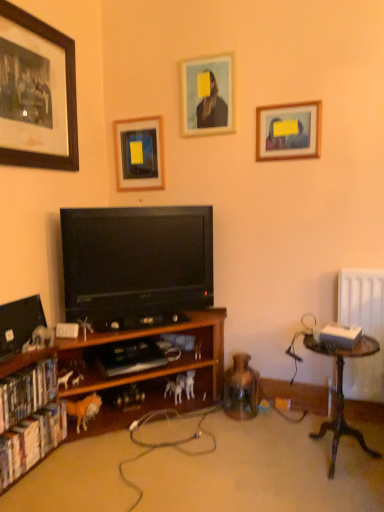
Question: In the image, is matte black picture frame at upper left, which is counted as the 4th picture frame, starting from the right, positioned in front of or behind orange plush horse at lower left, placed as the second animal when sorted from right to left?

Choices:
 (A) behind
 (B) front

Answer: (B)

Question: Choose the correct answer: Is matte black picture frame at upper left, which ranks as the first picture frame in left-to-right order, inside orange plush horse at lower left, the 2th animal positioned from the front, or outside it?

Choices:
 (A) inside
 (B) outside

Answer: (B)

Question: Which object is positioned closest to the white matte horse at lower center, placed as the first animal when sorted from right to left?

Choices:
 (A) wooden table at right
 (B) matte black picture frame at upper left, which ranks as the first picture frame in left-to-right order
 (C) orange plush horse at lower left, the 2th animal positioned from the front
 (D) wooden picture frame at upper center, the 2th picture frame viewed from the left
 (E) hardcover books at left, the 2th book ordered from the bottom

Answer: (C)

Question: Which object is the farthest from the matte wooden picture frame at upper center, placed as the 2th picture frame when sorted from right to left?

Choices:
 (A) hardcover book at lower left, placed as the second book when sorted from top to bottom
 (B) wooden framed picture at upper right, acting as the 4th picture frame starting from the left
 (C) white plastic horse at lower left, which ranks as the 3th animal in right-to-left order
 (D) white matte horse at lower center, placed as the first animal when sorted from right to left
 (E) wooden picture frame at upper center, which ranks as the third picture frame in right-to-left order

Answer: (A)